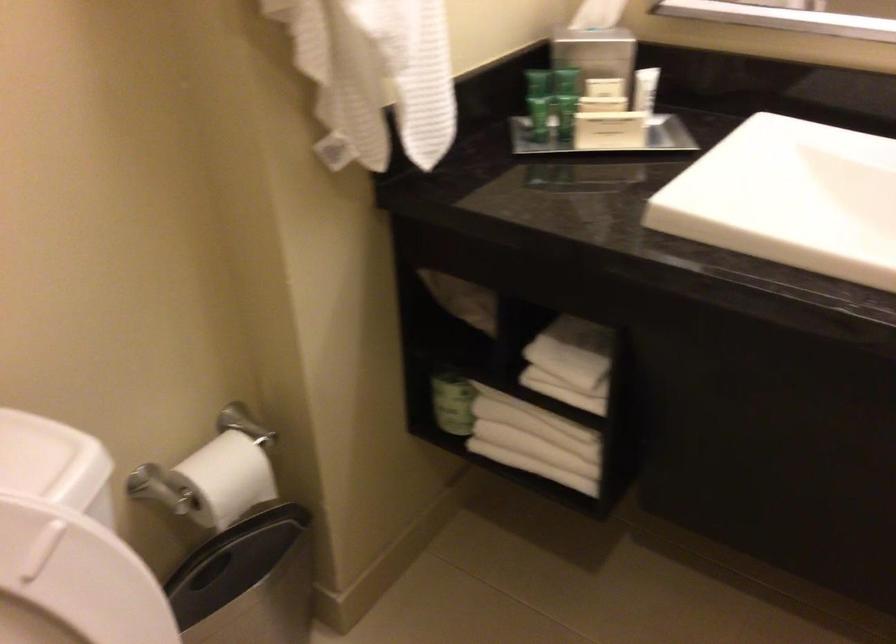
This screenshot has width=896, height=644. In order to click on small paper box in this screenshot , I will do `click(218, 210)`.